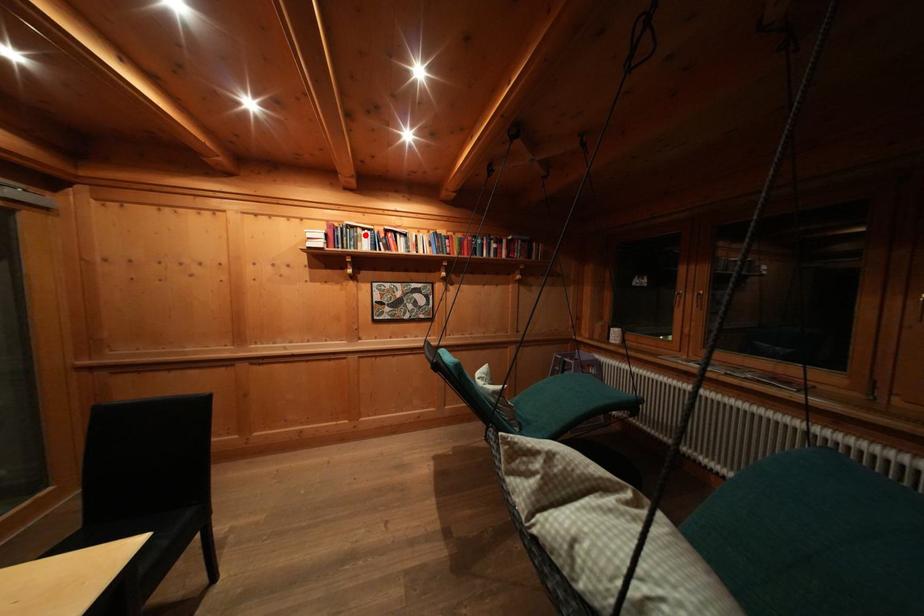
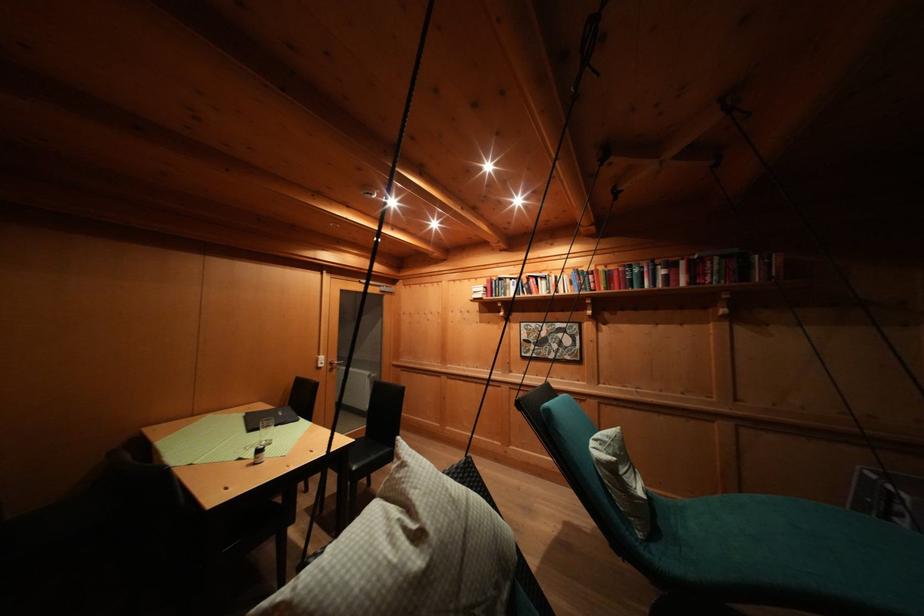
Find the pixel in the second image that matches the highlighted location in the first image.

(514, 285)